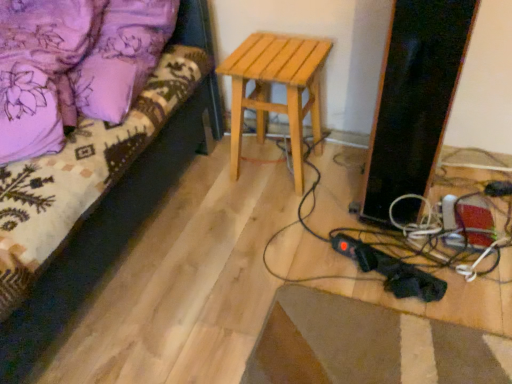
Question: Choose the correct answer: Is velvet purple bedspread at upper left inside light brown wooden stool at center or outside it?

Choices:
 (A) outside
 (B) inside

Answer: (A)

Question: In terms of width, does velvet purple bedspread at upper left look wider or thinner when compared to light brown wooden stool at center?

Choices:
 (A) thin
 (B) wide

Answer: (B)

Question: From their relative heights in the image, would you say velvet purple bedspread at upper left is taller or shorter than light brown wooden stool at center?

Choices:
 (A) tall
 (B) short

Answer: (B)

Question: Considering the positions of point (328, 48) and point (37, 261), is point (328, 48) closer or farther from the camera than point (37, 261)?

Choices:
 (A) closer
 (B) farther

Answer: (B)

Question: Looking at their shapes, would you say light brown wooden stool at center is wider or thinner than velvet purple bedspread at upper left?

Choices:
 (A) thin
 (B) wide

Answer: (A)

Question: In terms of size, does light brown wooden stool at center appear bigger or smaller than velvet purple bedspread at upper left?

Choices:
 (A) small
 (B) big

Answer: (A)

Question: From a real-world perspective, is light brown wooden stool at center positioned above or below velvet purple bedspread at upper left?

Choices:
 (A) below
 (B) above

Answer: (A)